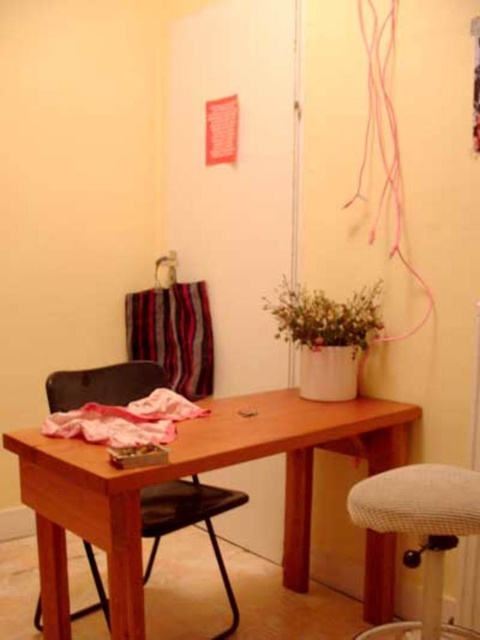
Which is behind, point (99, 490) or point (201, 506)?

The point (201, 506) is more distant.

Is wooden table at center bigger than black plastic chair at center?

Yes.

Between point (301, 557) and point (126, 404), which one is positioned in front?

Point (126, 404)

This screenshot has width=480, height=640. I want to click on wooden table at center, so click(187, 474).

Which is in front, point (408, 512) or point (151, 492)?

Point (408, 512) is in front.

Who is higher up, white textured bar stool at lower right or black plastic chair at center?

white textured bar stool at lower right is above.

Does point (437, 522) lie in front of point (207, 484)?

Yes, point (437, 522) is in front of point (207, 484).

Locate an element on the screen. The image size is (480, 640). white textured bar stool at lower right is located at coordinates (420, 532).

Is wooden table at center positioned behind white textured bar stool at lower right?

No, it is in front of white textured bar stool at lower right.

Measure the distance between wooden table at center and white textured bar stool at lower right.

wooden table at center is 17.67 inches away from white textured bar stool at lower right.

The height and width of the screenshot is (640, 480). What do you see at coordinates (187, 474) in the screenshot?
I see `wooden table at center` at bounding box center [187, 474].

Where is `wooden table at center`? The image size is (480, 640). wooden table at center is located at coordinates (187, 474).